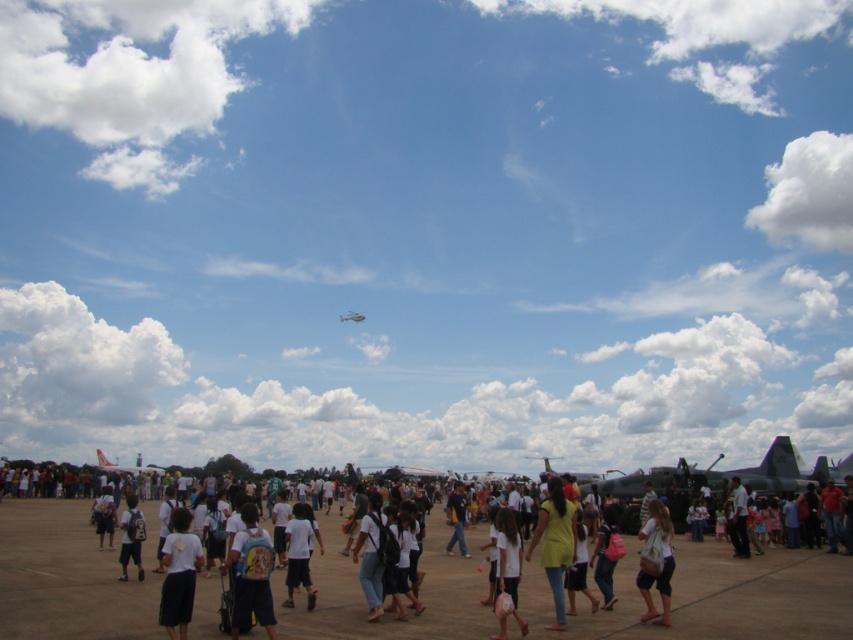
Question: Does yellow matte shirt at center appear under matte blue backpack at center?

Choices:
 (A) yes
 (B) no

Answer: (A)

Question: Can you confirm if white matte shorts at center is thinner than white cotton shirt at center?

Choices:
 (A) yes
 (B) no

Answer: (A)

Question: Which point appears closest to the camera in this image?

Choices:
 (A) (743, 497)
 (B) (292, 598)
 (C) (74, 564)
 (D) (653, 506)

Answer: (D)

Question: Which point appears farthest from the camera in this image?

Choices:
 (A) (518, 580)
 (B) (642, 616)
 (C) (180, 515)
 (D) (267, 608)

Answer: (B)

Question: Is light brown fabric bag at lower right wider than white cotton shirt at center?

Choices:
 (A) yes
 (B) no

Answer: (A)

Question: Which of the following is the closest to the observer?

Choices:
 (A) metallic gray fighter jet at upper center
 (B) white matte shirt at center
 (C) yellow matte shirt at center

Answer: (B)